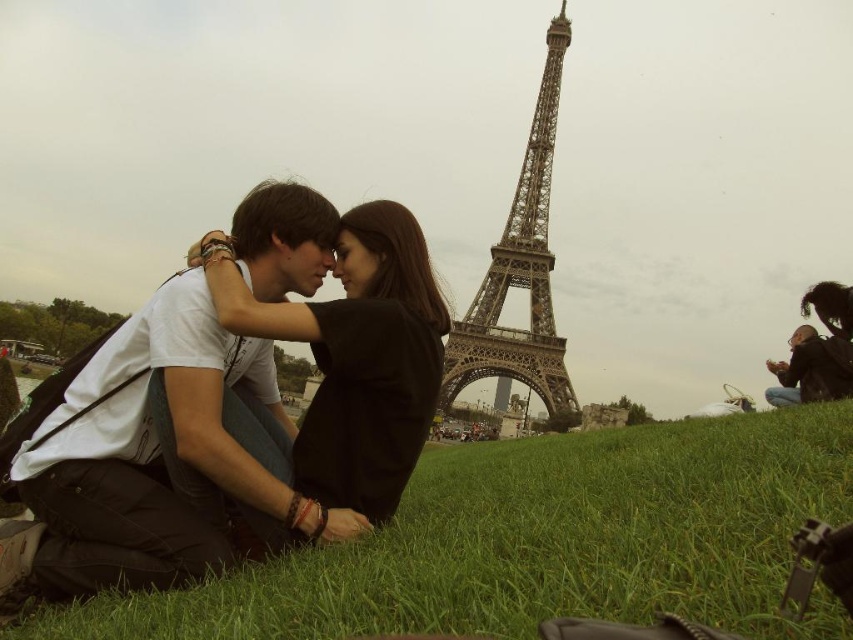
Is white matte t-shirt at center behind dark brown leather jacket at lower right?

No, white matte t-shirt at center is in front of dark brown leather jacket at lower right.

Is white matte t-shirt at center in front of dark brown leather jacket at lower right?

Yes.

Who is more forward, (x=154, y=577) or (x=770, y=365)?

Point (x=154, y=577)

Find the location of `white matte t-shirt at center`. white matte t-shirt at center is located at coordinates (244, 403).

Does metallic gray eiffel tower at center have a lesser width compared to dark brown leather jacket at lower right?

No, metallic gray eiffel tower at center is not thinner than dark brown leather jacket at lower right.

Is metallic gray eiffel tower at center below dark brown leather jacket at lower right?

No.

Is point (554, 330) farther from viewer compared to point (819, 401)?

No, it is not.

Locate an element on the screen. Image resolution: width=853 pixels, height=640 pixels. metallic gray eiffel tower at center is located at coordinates (520, 269).

Between point (154, 436) and point (361, 248), which one is positioned behind?

Positioned behind is point (361, 248).

Does point (410, 413) come farther from viewer compared to point (358, 368)?

No, (410, 413) is in front of (358, 368).

Where is `white matte t-shirt at center`? white matte t-shirt at center is located at coordinates (244, 403).